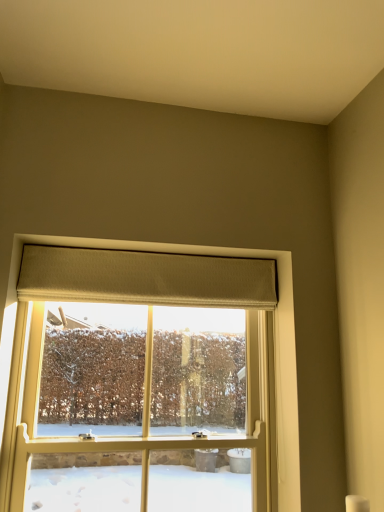
Question: Should I look upward or downward to see beige textured curtain at upper center?

Choices:
 (A) up
 (B) down

Answer: (B)

Question: Does beige textured curtain at upper center have a larger size compared to clear glass window at center?

Choices:
 (A) no
 (B) yes

Answer: (A)

Question: Can you confirm if beige textured curtain at upper center is wider than clear glass window at center?

Choices:
 (A) no
 (B) yes

Answer: (A)

Question: Considering the relative positions of beige textured curtain at upper center and clear glass window at center in the image provided, is beige textured curtain at upper center in front of clear glass window at center?

Choices:
 (A) no
 (B) yes

Answer: (A)

Question: Can you confirm if beige textured curtain at upper center is smaller than clear glass window at center?

Choices:
 (A) yes
 (B) no

Answer: (A)

Question: Can you confirm if beige textured curtain at upper center is shorter than clear glass window at center?

Choices:
 (A) no
 (B) yes

Answer: (B)

Question: Does beige textured curtain at upper center come behind clear glass window at center?

Choices:
 (A) no
 (B) yes

Answer: (B)

Question: Is beige textured curtain at upper center a part of clear glass window at center?

Choices:
 (A) no
 (B) yes

Answer: (A)

Question: Considering the relative positions of clear glass window at center and beige textured curtain at upper center in the image provided, is clear glass window at center in front of beige textured curtain at upper center?

Choices:
 (A) yes
 (B) no

Answer: (A)

Question: Can you confirm if clear glass window at center is taller than beige textured curtain at upper center?

Choices:
 (A) yes
 (B) no

Answer: (A)

Question: Is clear glass window at center bigger than beige textured curtain at upper center?

Choices:
 (A) no
 (B) yes

Answer: (B)

Question: From a real-world perspective, is clear glass window at center below beige textured curtain at upper center?

Choices:
 (A) yes
 (B) no

Answer: (A)

Question: Considering the relative sizes of clear glass window at center and beige textured curtain at upper center in the image provided, is clear glass window at center thinner than beige textured curtain at upper center?

Choices:
 (A) no
 (B) yes

Answer: (A)

Question: From a real-world perspective, is beige textured curtain at upper center above or below clear glass window at center?

Choices:
 (A) below
 (B) above

Answer: (B)